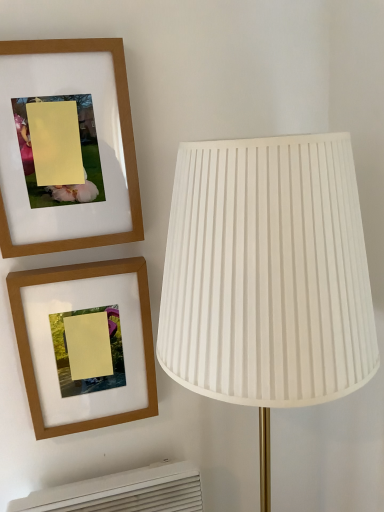
Question: Is white plastic air conditioner at lower left bigger than wooden frame at upper left, which appears as the second picture frame when ordered from the bottom?

Choices:
 (A) no
 (B) yes

Answer: (B)

Question: Would you say white plastic air conditioner at lower left is a long distance from wooden frame at upper left, the 1th picture frame viewed from the top?

Choices:
 (A) no
 (B) yes

Answer: (A)

Question: Does white plastic air conditioner at lower left appear on the right side of wooden frame at upper left, which appears as the second picture frame when ordered from the bottom?

Choices:
 (A) no
 (B) yes

Answer: (B)

Question: Is wooden frame at upper left, the 1th picture frame viewed from the top, surrounded by white plastic air conditioner at lower left?

Choices:
 (A) no
 (B) yes

Answer: (A)

Question: Considering the relative positions of white plastic air conditioner at lower left and wooden frame at upper left, the 1th picture frame viewed from the top, in the image provided, is white plastic air conditioner at lower left in front of wooden frame at upper left, the 1th picture frame viewed from the top,?

Choices:
 (A) yes
 (B) no

Answer: (B)

Question: Is wooden frame at upper left, the 2th picture frame from the top, inside or outside of white plastic air conditioner at lower left?

Choices:
 (A) outside
 (B) inside

Answer: (A)

Question: From a real-world perspective, is wooden frame at upper left, the first picture frame ordered from the bottom, above or below white plastic air conditioner at lower left?

Choices:
 (A) above
 (B) below

Answer: (A)

Question: Looking at the image, does wooden frame at upper left, the 2th picture frame from the top, seem bigger or smaller compared to white plastic air conditioner at lower left?

Choices:
 (A) small
 (B) big

Answer: (A)

Question: From their relative heights in the image, would you say wooden frame at upper left, the 2th picture frame from the top, is taller or shorter than white plastic air conditioner at lower left?

Choices:
 (A) short
 (B) tall

Answer: (B)

Question: Is white pleated fabric lampshade at right to the left or to the right of wooden frame at upper left, the first picture frame ordered from the bottom, in the image?

Choices:
 (A) right
 (B) left

Answer: (A)

Question: Is point (188, 203) positioned closer to the camera than point (150, 388)?

Choices:
 (A) closer
 (B) farther

Answer: (A)

Question: In terms of width, does white pleated fabric lampshade at right look wider or thinner when compared to wooden frame at upper left, the first picture frame ordered from the bottom?

Choices:
 (A) wide
 (B) thin

Answer: (A)

Question: From their relative heights in the image, would you say white pleated fabric lampshade at right is taller or shorter than wooden frame at upper left, the 2th picture frame from the top?

Choices:
 (A) tall
 (B) short

Answer: (A)

Question: Considering the positions of point (233, 320) and point (167, 463), is point (233, 320) closer or farther from the camera than point (167, 463)?

Choices:
 (A) farther
 (B) closer

Answer: (B)

Question: In the image, is white pleated fabric lampshade at right on the left side or the right side of white plastic air conditioner at lower left?

Choices:
 (A) left
 (B) right

Answer: (B)